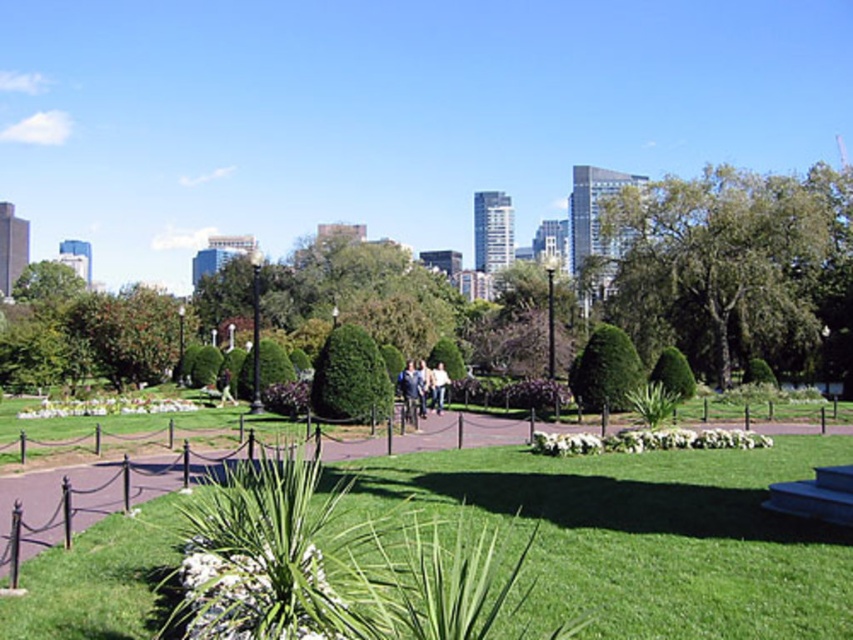
Consider the image. You are a photographer standing in the park and want to capture a photo of the green grass at center and the white cotton shirt at center. According to the scene description, which object is positioned higher in the image?

The green grass at center is positioned higher than the white cotton shirt at center.

You are a person standing at the edge of the park. You want to walk towards the city skyline in the background. Do you need to step over the green grass at center or walk around it since the blue denim jeans at center are blocking your path?

The green grass at center is in front of blue denim jeans at center, so you need to step over the green grass at center to avoid the blue denim jeans at center blocking your path.